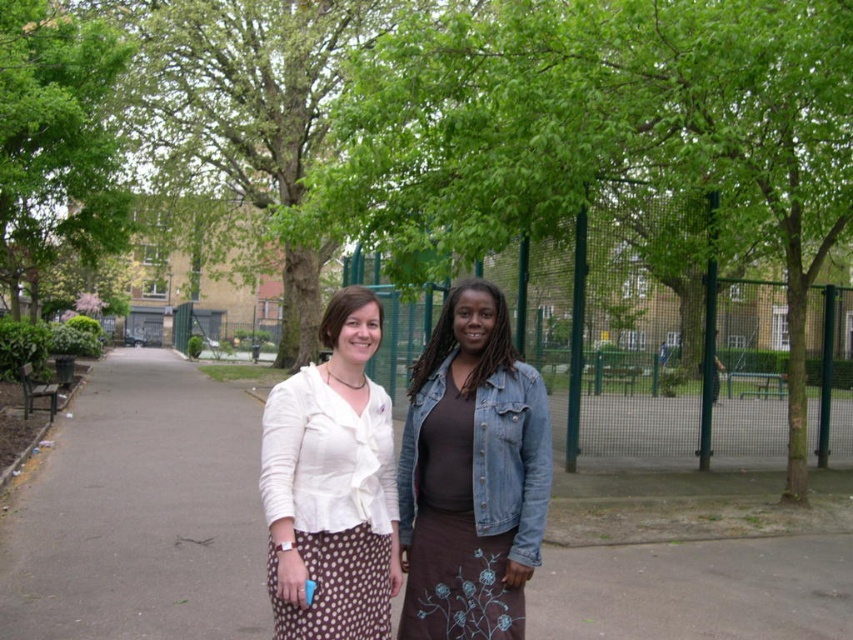
Is brown asphalt at center to the right of denim jacket at center from the viewer's perspective?

No, brown asphalt at center is not to the right of denim jacket at center.

From the picture: Does brown asphalt at center have a smaller size compared to denim jacket at center?

Incorrect, brown asphalt at center is not smaller in size than denim jacket at center.

The width and height of the screenshot is (853, 640). Identify the location of brown asphalt at center. (140, 513).

Find the location of a particular element. brown asphalt at center is located at coordinates click(x=140, y=513).

Image resolution: width=853 pixels, height=640 pixels. Describe the element at coordinates (140, 513) in the screenshot. I see `brown asphalt at center` at that location.

Consider the image. Which of these two, brown asphalt at center or white satin blouse at center, stands shorter?

Standing shorter between the two is brown asphalt at center.

In order to click on brown asphalt at center in this screenshot , I will do `click(140, 513)`.

Is green leafy tree at center below green leafy tree at upper left?

Yes, green leafy tree at center is below green leafy tree at upper left.

Does green leafy tree at center appear over green leafy tree at upper left?

No, green leafy tree at center is not above green leafy tree at upper left.

Find the location of `green leafy tree at center`. green leafy tree at center is located at coordinates (601, 134).

Locate an element on the screen. green leafy tree at center is located at coordinates (601, 134).